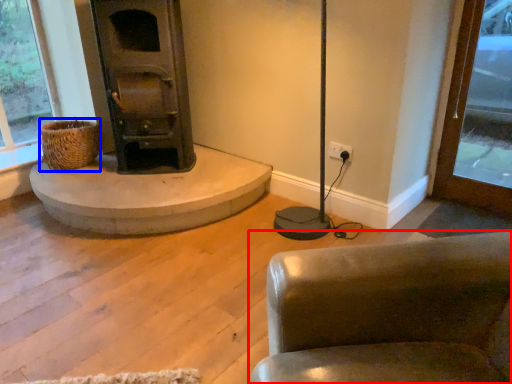
Question: Which of the following is the closest to the observer, chair (highlighted by a red box) or basket (highlighted by a blue box)?

Choices:
 (A) chair
 (B) basket

Answer: (A)